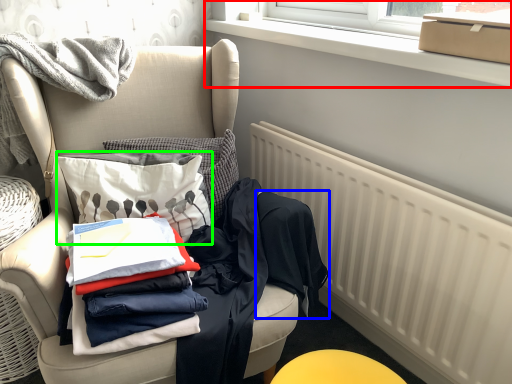
Question: Which object is positioned farthest from window frame (highlighted by a red box)? Select from clothing (highlighted by a blue box) and throw pillow (highlighted by a green box).

Choices:
 (A) clothing
 (B) throw pillow

Answer: (B)